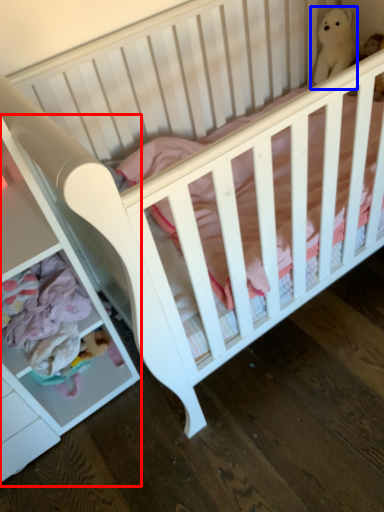
Question: Which of the following is the closest to the observer, dresser (highlighted by a red box) or figurine (highlighted by a blue box)?

Choices:
 (A) dresser
 (B) figurine

Answer: (A)